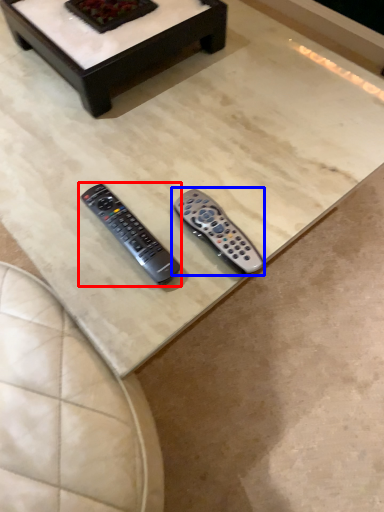
Question: Which of the following is the closest to the observer, remote control (highlighted by a red box) or remote control (highlighted by a blue box)?

Choices:
 (A) remote control
 (B) remote control

Answer: (A)